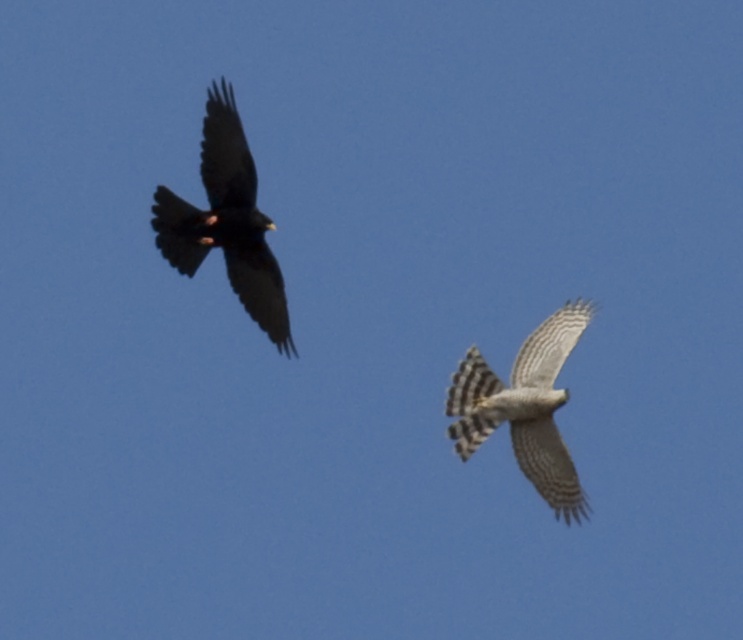
You are a birdwatcher observing two birds in the sky. You see the dark brown feathers at left and the gray striped feathers at center. Which one is located to the right of the other?

The gray striped feathers at center is located to the right of the dark brown feathers at left because the dark brown feathers at left is positioned on the left side of gray striped feathers at center.

You are an ornithologist observing two birds in the sky. You notice the dark brown feathers at left and the gray striped feathers at center. Which of these two birds has a larger size?

The gray striped feathers at center is larger in size compared to the dark brown feathers at left.